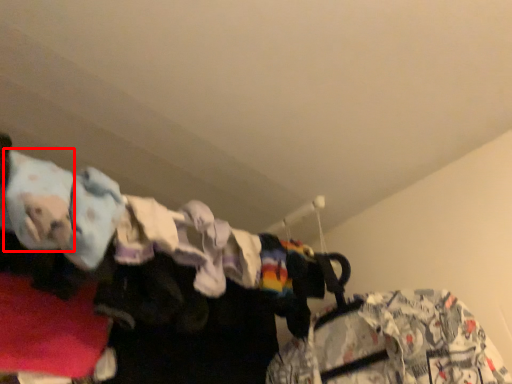
Question: From the image's perspective, where is clothing (annotated by the red box) located relative to clothing?

Choices:
 (A) above
 (B) below

Answer: (A)